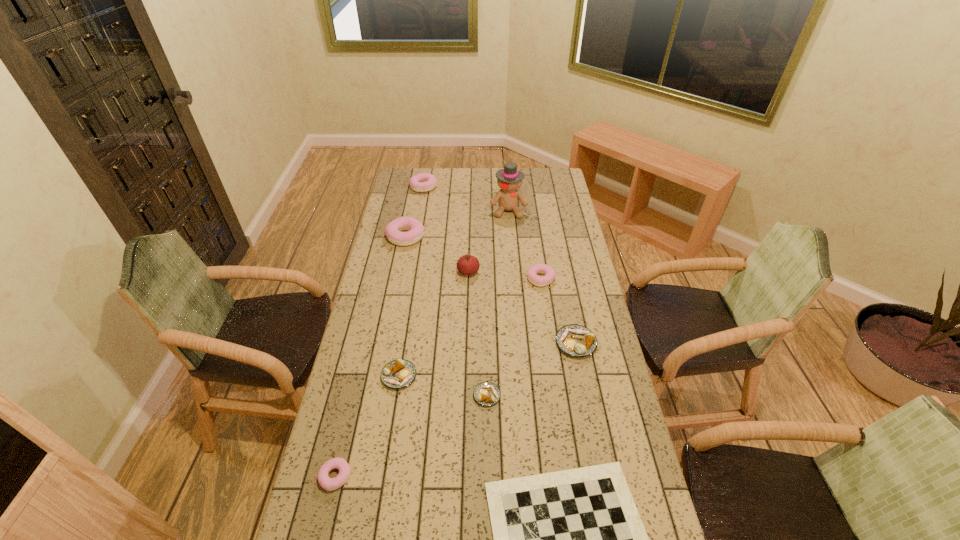
Find the location of a particular element. the second farthest object is located at coordinates tap(509, 179).

The width and height of the screenshot is (960, 540). I want to click on the tallest object, so click(x=509, y=179).

Identify the location of red tomato. The image size is (960, 540). (467, 265).

I want to click on tomato, so click(x=467, y=265).

At what (x,y) coordinates should I click in order to perform the action: click on the third farthest object. Please return your answer as a coordinate pair (x, y). This screenshot has height=540, width=960. Looking at the image, I should click on (393, 230).

I want to click on the tallest pastry, so click(393, 230).

At what (x,y) coordinates should I click in order to perform the action: click on the farthest object. Please return your answer as a coordinate pair (x, y). The height and width of the screenshot is (540, 960). Looking at the image, I should click on (423, 182).

Where is `the second biggest pink pastry`? This screenshot has width=960, height=540. the second biggest pink pastry is located at coordinates tap(423, 182).

Locate an element on the screen. The image size is (960, 540). the fourth farthest pastry is located at coordinates (575, 340).

The height and width of the screenshot is (540, 960). Identify the location of the rightmost brown pastry. click(x=575, y=340).